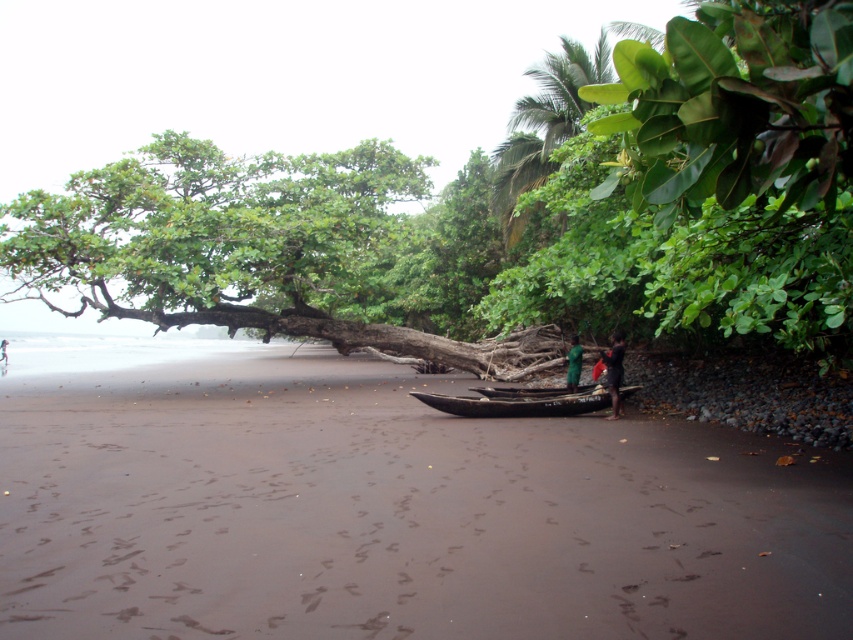
Question: Does black wood boat at center have a greater width compared to dark brown wooden canoe at center?

Choices:
 (A) yes
 (B) no

Answer: (A)

Question: Is green leafy tree at upper left above green fabric person at center?

Choices:
 (A) no
 (B) yes

Answer: (B)

Question: Can you confirm if green leafy tree at upper left is positioned to the right of green fabric person at center?

Choices:
 (A) no
 (B) yes

Answer: (A)

Question: Which point is closer to the camera?

Choices:
 (A) (612, 362)
 (B) (595, 609)
 (C) (469, 413)
 (D) (705, 280)

Answer: (B)

Question: Considering the real-world distances, which object is farthest from the brown sandy beach at center?

Choices:
 (A) green leafy tree at upper left
 (B) dark skin person at center
 (C) black wood boat at center

Answer: (B)

Question: Which object is positioned closest to the green fabric person at center?

Choices:
 (A) dark skin person at center
 (B) green leafy tree at upper left
 (C) brown sandy beach at center
 (D) black wood boat at center

Answer: (A)